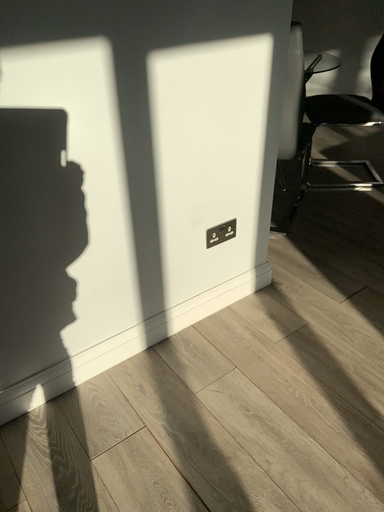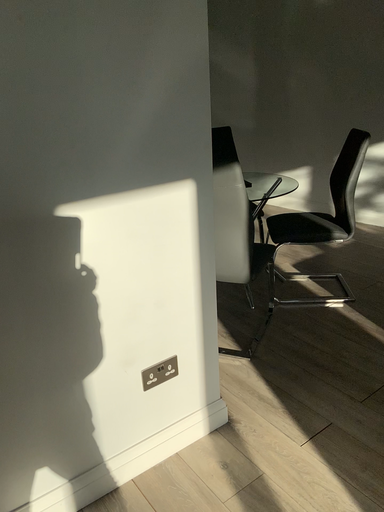
Question: Which way did the camera rotate in the video?

Choices:
 (A) rotated downward
 (B) rotated upward

Answer: (B)